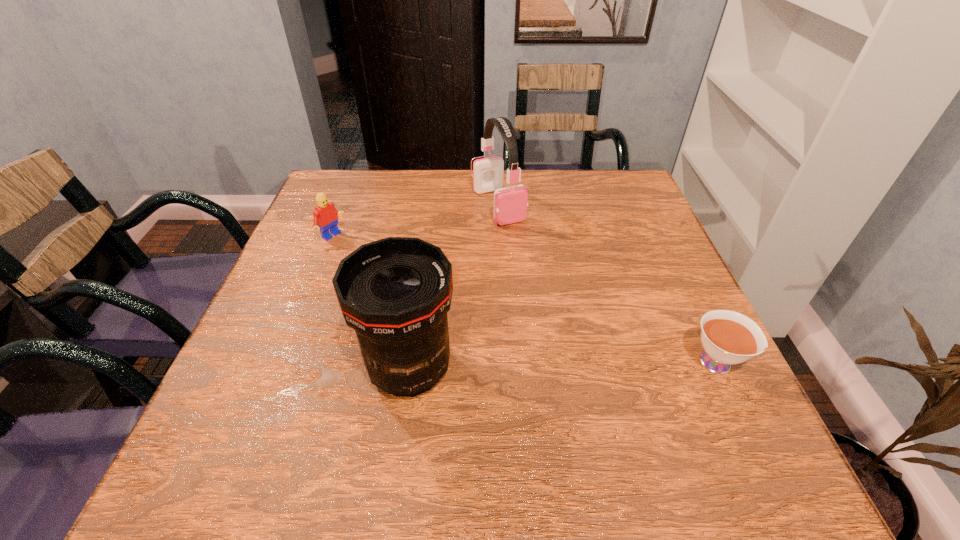
Where is `free space on the desktop that is between the telephoto lens and the rightmost object and is positioned on the front-facing side of the third tallest object`? free space on the desktop that is between the telephoto lens and the rightmost object and is positioned on the front-facing side of the third tallest object is located at coordinates (538, 367).

Where is `free spot on the desktop that is between the telephoto lens and the teacup and is positioned on the outer surface of the earphone`? The height and width of the screenshot is (540, 960). free spot on the desktop that is between the telephoto lens and the teacup and is positioned on the outer surface of the earphone is located at coordinates (611, 365).